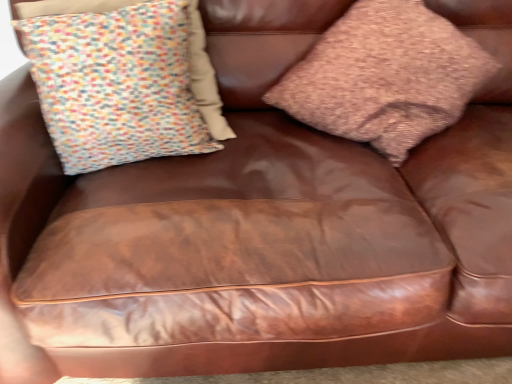
Question: Considering the positions of brown textured pillow at upper right, the 2th pillow viewed from the left, and multicolored fabric pillow at upper left, which appears as the second pillow when viewed from the right, in the image, is brown textured pillow at upper right, the 2th pillow viewed from the left, taller or shorter than multicolored fabric pillow at upper left, which appears as the second pillow when viewed from the right,?

Choices:
 (A) short
 (B) tall

Answer: (B)

Question: Is point (430, 19) closer or farther from the camera than point (129, 76)?

Choices:
 (A) closer
 (B) farther

Answer: (B)

Question: Looking at the image, does brown textured pillow at upper right, the 2th pillow viewed from the left, seem bigger or smaller compared to multicolored fabric pillow at upper left, which appears as the second pillow when viewed from the right?

Choices:
 (A) small
 (B) big

Answer: (B)

Question: Is point (147, 110) positioned closer to the camera than point (387, 76)?

Choices:
 (A) closer
 (B) farther

Answer: (A)

Question: Looking at the image, does multicolored fabric pillow at upper left, which appears as the second pillow when viewed from the right, seem bigger or smaller compared to brown textured pillow at upper right, the 2th pillow viewed from the left?

Choices:
 (A) big
 (B) small

Answer: (B)

Question: Is multicolored fabric pillow at upper left, which appears as the second pillow when viewed from the right, wider or thinner than brown textured pillow at upper right, the 2th pillow viewed from the left?

Choices:
 (A) thin
 (B) wide

Answer: (A)

Question: From a real-world perspective, is multicolored fabric pillow at upper left, acting as the 1th pillow starting from the left, physically located above or below brown textured pillow at upper right, which is counted as the first pillow, starting from the right?

Choices:
 (A) below
 (B) above

Answer: (B)